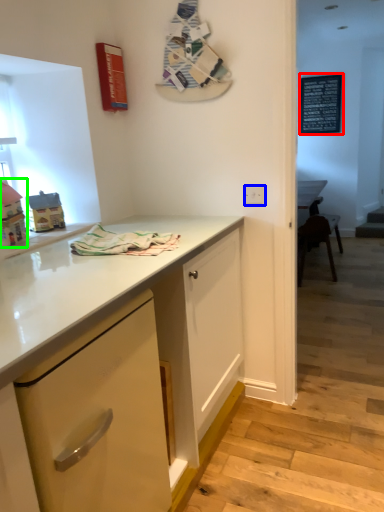
Question: Based on their relative distances, which object is nearer to bulletin board (highlighted by a red box)? Choose from electric outlet (highlighted by a blue box) and toy (highlighted by a green box).

Choices:
 (A) electric outlet
 (B) toy

Answer: (A)